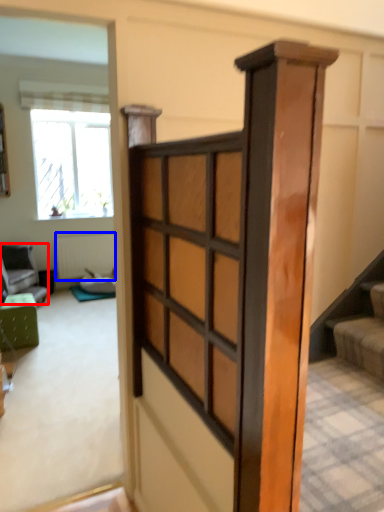
Question: Which point is closer to the camera, furniture (highlighted by a red box) or radiator (highlighted by a blue box)?

Choices:
 (A) furniture
 (B) radiator

Answer: (A)